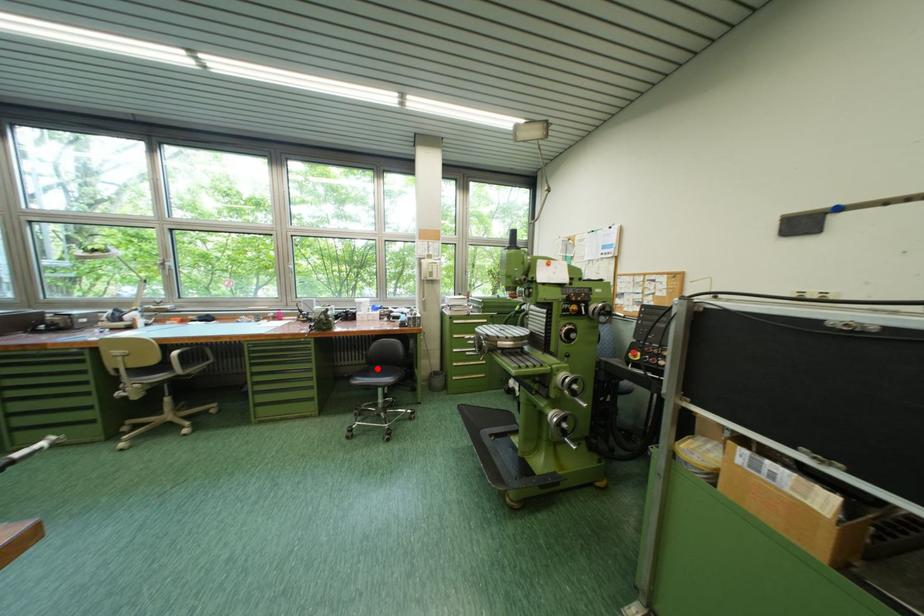
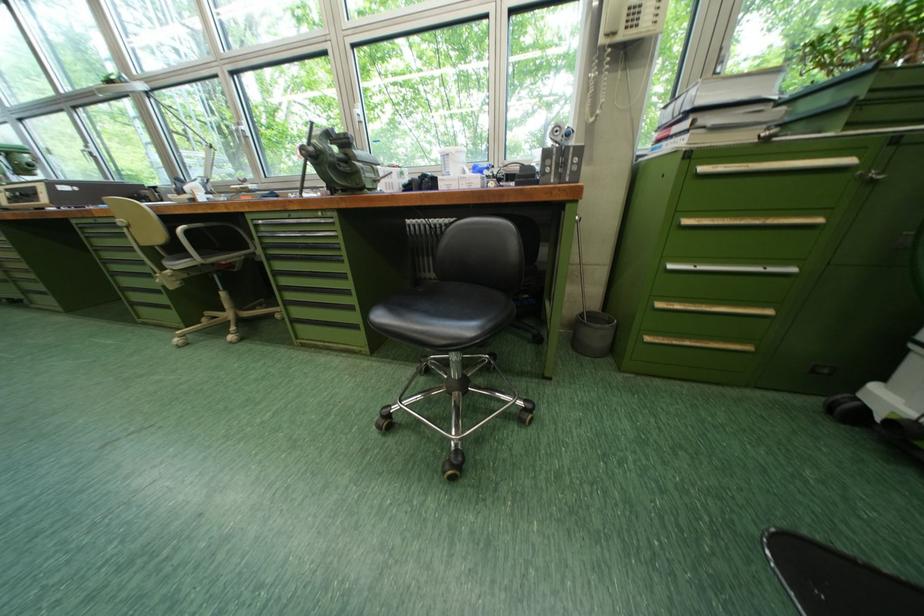
Question: I am providing you with two images of the same scene from different viewpoints. A red point is marked on the first image. Can you still see the location of the red point in image 2?

Choices:
 (A) Yes
 (B) No

Answer: (A)